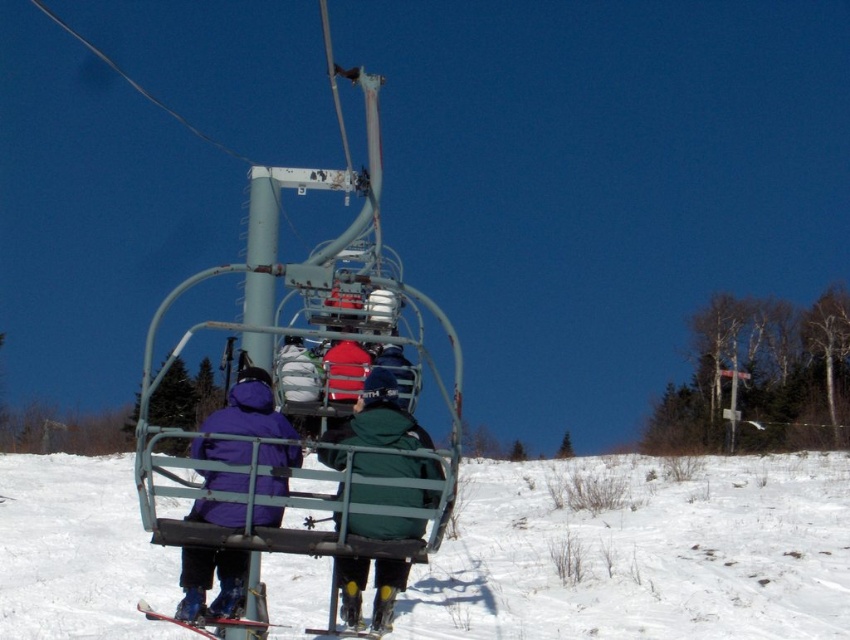
Question: In this image, where is white powdery snow at center located relative to matte black ski at lower center?

Choices:
 (A) above
 (B) below

Answer: (B)

Question: Is purple fleece jacket at left above metallic skis at lower center?

Choices:
 (A) no
 (B) yes

Answer: (B)

Question: Does green matte jacket at center have a smaller size compared to matte black ski at lower center?

Choices:
 (A) no
 (B) yes

Answer: (B)

Question: Which point is closer to the camera taking this photo?

Choices:
 (A) (151, 609)
 (B) (352, 460)
 (C) (343, 625)

Answer: (B)

Question: Among these points, which one is nearest to the camera?

Choices:
 (A) (822, 496)
 (B) (354, 557)

Answer: (B)

Question: Which object is the closest to the matte black ski at lower center?

Choices:
 (A) green matte jacket at center
 (B) metallic skis at lower center

Answer: (B)